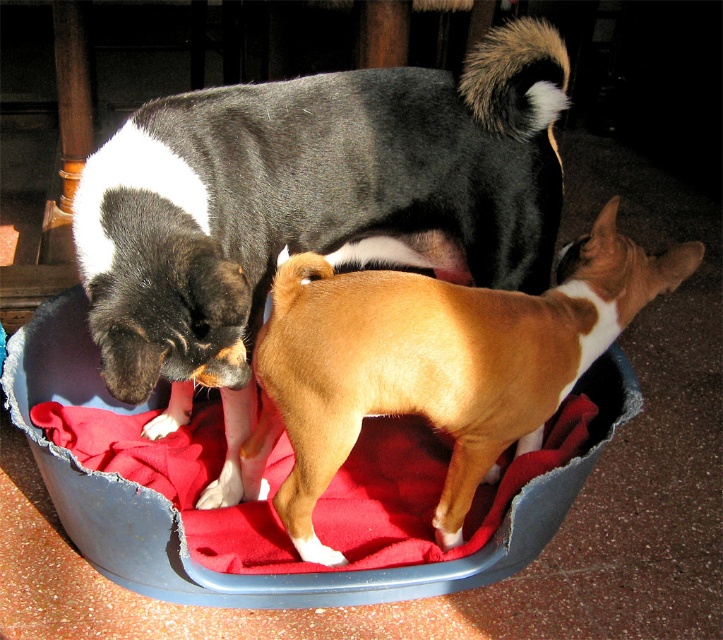
You are a pet owner trying to determine the best way to separate two dogs in a shared bed. The bed has a blue rim and is on a speckled floor. You see the black and white fur at upper left and the brown smooth dog at center. Which dog is closer to the left edge of the bed?

The black and white fur at upper left is positioned on the left side of brown smooth dog at center, so the black and white fur at upper left is closer to the left edge of the bed.